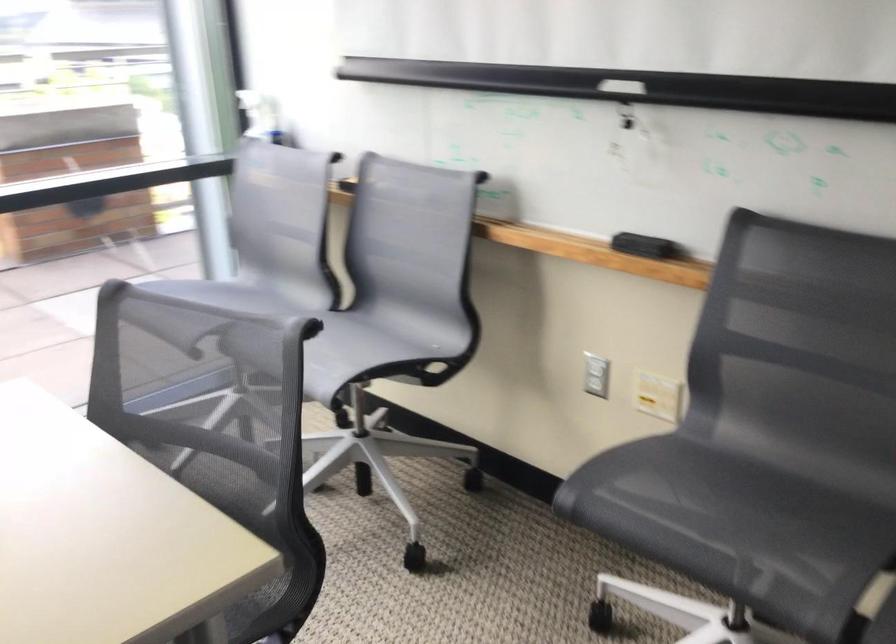
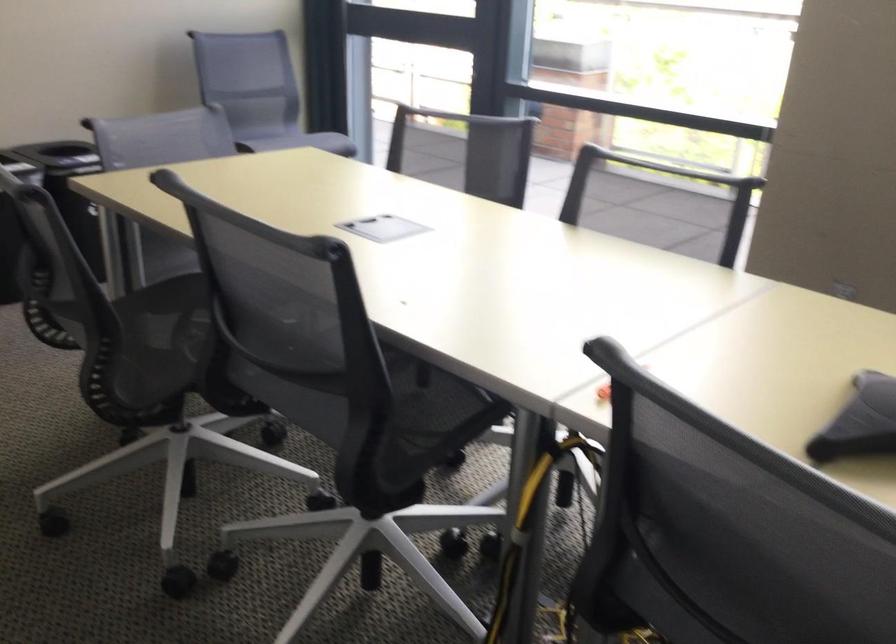
Based on the continuous images, in which direction is the camera rotating?

The camera rotated toward left-down.